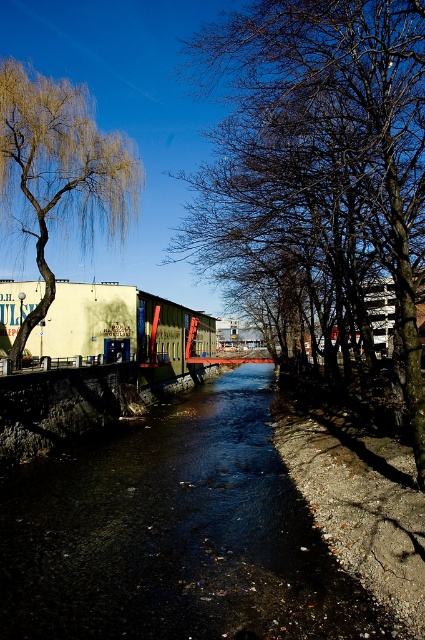
Is point (110, 532) positioned before point (51, 216)?

That is True.

Does black smooth water at center lie in front of golden textured willow at upper left?

Yes.

Is point (198, 513) less distant than point (73, 140)?

Yes, point (198, 513) is closer to viewer.

Locate an element on the screen. Image resolution: width=425 pixels, height=640 pixels. black smooth water at center is located at coordinates (175, 532).

What do you see at coordinates (175, 532) in the screenshot?
I see `black smooth water at center` at bounding box center [175, 532].

Which is more to the right, black smooth water at center or bare branches at center?

From the viewer's perspective, bare branches at center appears more on the right side.

Who is more distant from viewer, (121, 506) or (274, 218)?

Positioned behind is point (274, 218).

This screenshot has width=425, height=640. In order to click on black smooth water at center in this screenshot , I will do `click(175, 532)`.

Is bare branches at center positioned before golden textured willow at upper left?

That is True.

You are a GUI agent. You are given a task and a screenshot of the screen. Output one action in this format:
    pyautogui.click(x=<x>, y=<y>)
    Task: Click on the bare branches at center
    
    Given the screenshot: What is the action you would take?
    pyautogui.click(x=320, y=150)

Measure the distance between bare branches at center and camera.

They are 9.46 meters apart.

At what (x,y) coordinates should I click in order to perform the action: click on bare branches at center. Please return your answer as a coordinate pair (x, y). The height and width of the screenshot is (640, 425). Looking at the image, I should click on (320, 150).